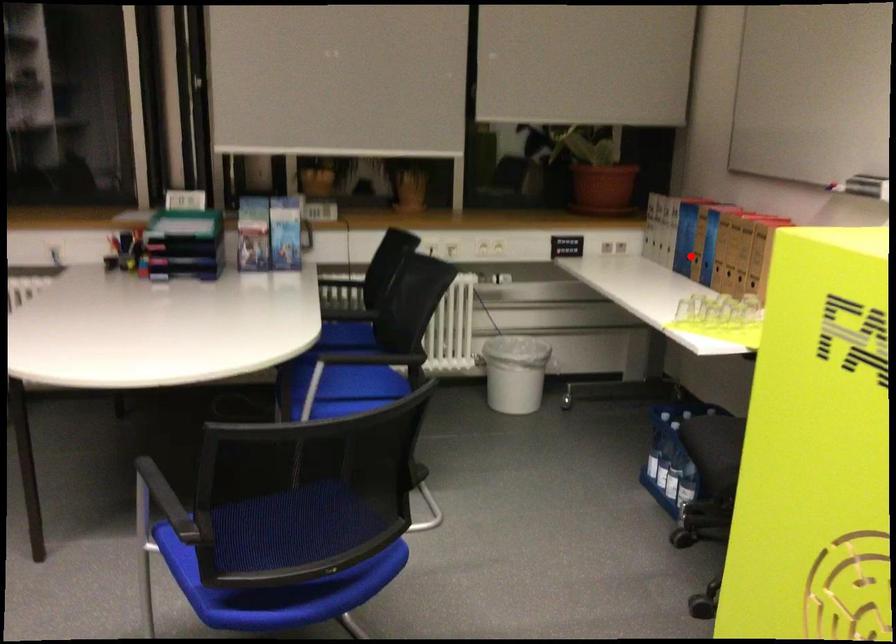
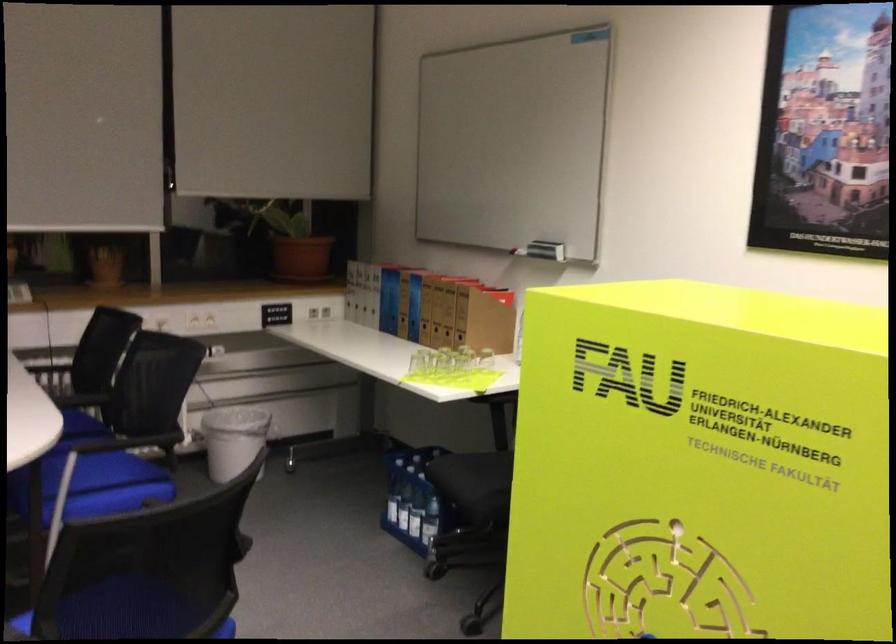
Question: I am providing you with two images of the same scene from different viewpoints. Given a red point in image1, look at the same physical point in image2. Is it:

Choices:
 (A) Closer to the viewpoint
 (B) Farther from the viewpoint

Answer: (B)